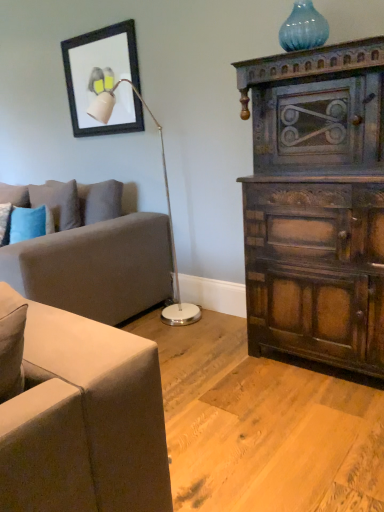
Identify the location of vacant area that lies between white glossy floor lamp at upper left and dark wood cabinet at right. (215, 338).